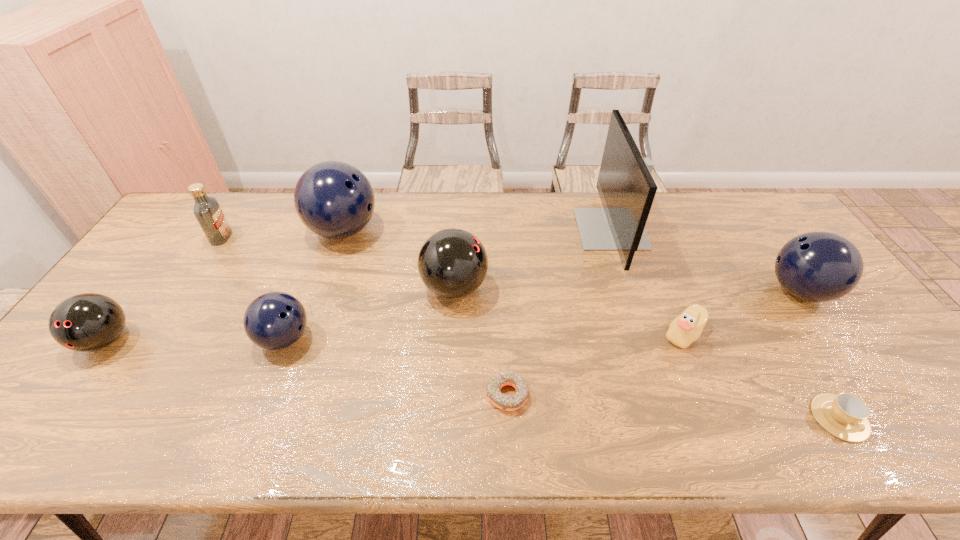
Where is `free space located 0.310m at the beak of the eighth tallest object`? The image size is (960, 540). free space located 0.310m at the beak of the eighth tallest object is located at coordinates pos(542,334).

You are a GUI agent. You are given a task and a screenshot of the screen. Output one action in this format:
    pyautogui.click(x=<x>, y=<y>)
    Task: Click on the free location located on the right of the shortest object
    Image resolution: width=960 pixels, height=540 pixels.
    Given the screenshot: What is the action you would take?
    pyautogui.click(x=618, y=395)

Identify the location of computer monitor at the far edge. (626, 187).

The width and height of the screenshot is (960, 540). Find the location of `bowling ball that is at the far edge`. bowling ball that is at the far edge is located at coordinates (333, 199).

Identify the location of vodka that is at the far edge. (207, 210).

Identify the location of cup that is at the near edge. (845, 415).

Where is `doughnut that is at the near edge`? The width and height of the screenshot is (960, 540). doughnut that is at the near edge is located at coordinates (505, 402).

The height and width of the screenshot is (540, 960). In order to click on object located at the left edge in this screenshot , I will do `click(86, 322)`.

Locate an element on the screen. object present at the right edge is located at coordinates pos(818,266).

Find the location of a particular element. The width and height of the screenshot is (960, 540). vacant space at the far edge of the desktop is located at coordinates (684, 191).